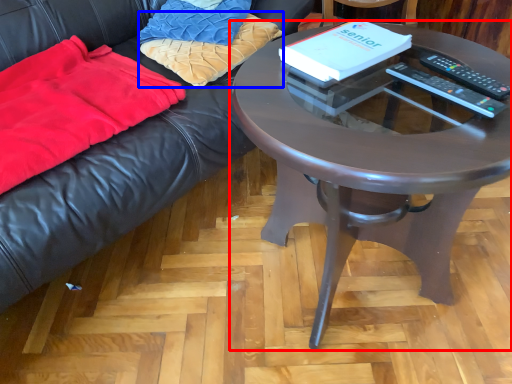
Question: Among these objects, which one is nearest to the camera, coffee table (highlighted by a red box) or pillow (highlighted by a blue box)?

Choices:
 (A) coffee table
 (B) pillow

Answer: (A)